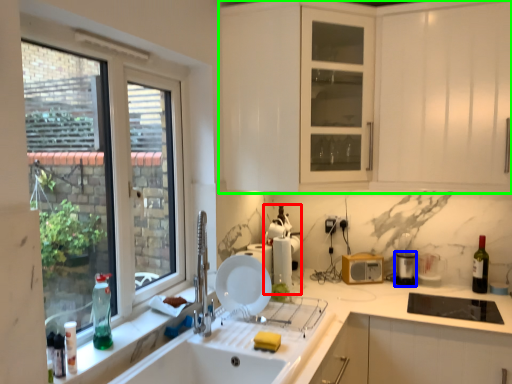
Question: Which is nearer to the appliance (highlighted by a red box)? appliance (highlighted by a blue box) or cabinetry (highlighted by a green box).

Choices:
 (A) appliance
 (B) cabinetry

Answer: (A)